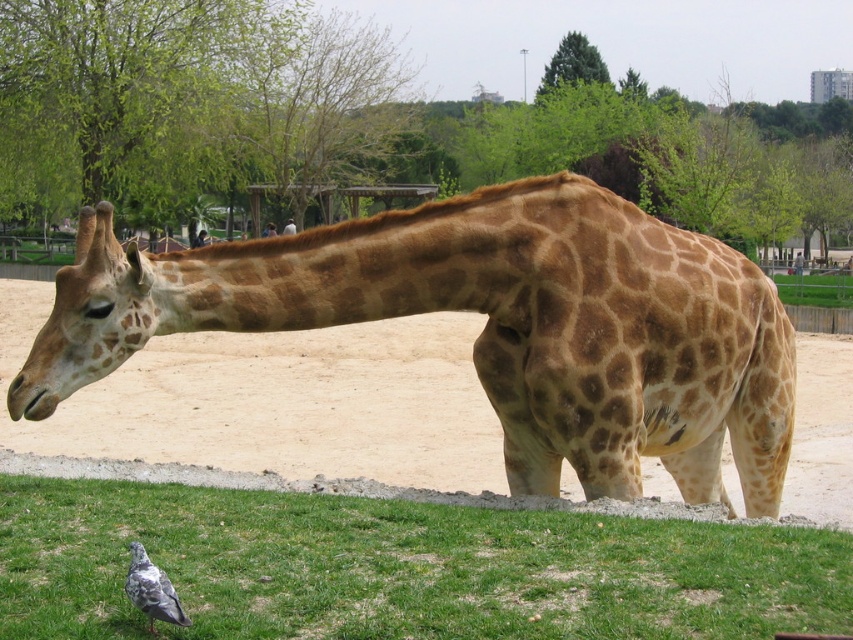
Question: Which is farther from the brown spotted neck at center?

Choices:
 (A) gray feathered pigeon at lower left
 (B) green grass at lower left
 (C) brown spotted giraffe at center

Answer: (A)

Question: Is green grass at lower left further to camera compared to brown spotted neck at center?

Choices:
 (A) yes
 (B) no

Answer: (B)

Question: Among these points, which one is farthest from the camera?

Choices:
 (A) (297, 294)
 (B) (339, 264)
 (C) (74, 625)
 (D) (132, 572)

Answer: (B)

Question: Is green grass at lower left above gray feathered pigeon at lower left?

Choices:
 (A) no
 (B) yes

Answer: (A)

Question: Observing the image, what is the correct spatial positioning of brown spotted giraffe at center in reference to green grass at lower left?

Choices:
 (A) left
 (B) right

Answer: (B)

Question: Which point is closer to the camera taking this photo?

Choices:
 (A) (294, 296)
 (B) (611, 198)
 (C) (175, 600)
 (D) (258, 532)

Answer: (C)